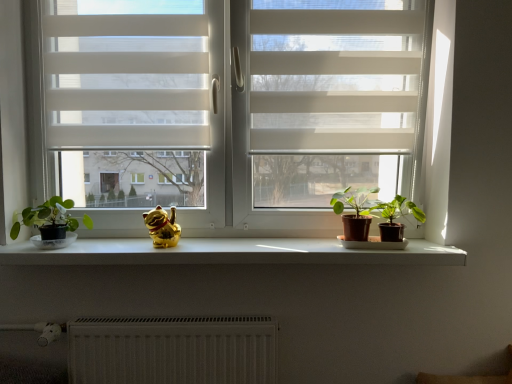
Find the location of a particular element. Image resolution: width=512 pixels, height=384 pixels. vacant area that lies to the right of green matte plant at left, the 3th houseplant when ordered from right to left is located at coordinates (110, 245).